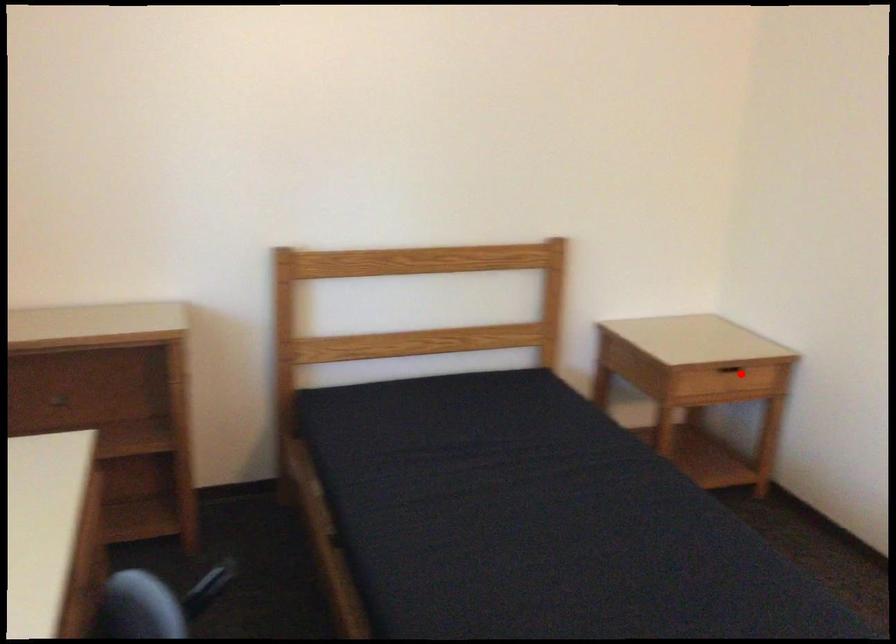
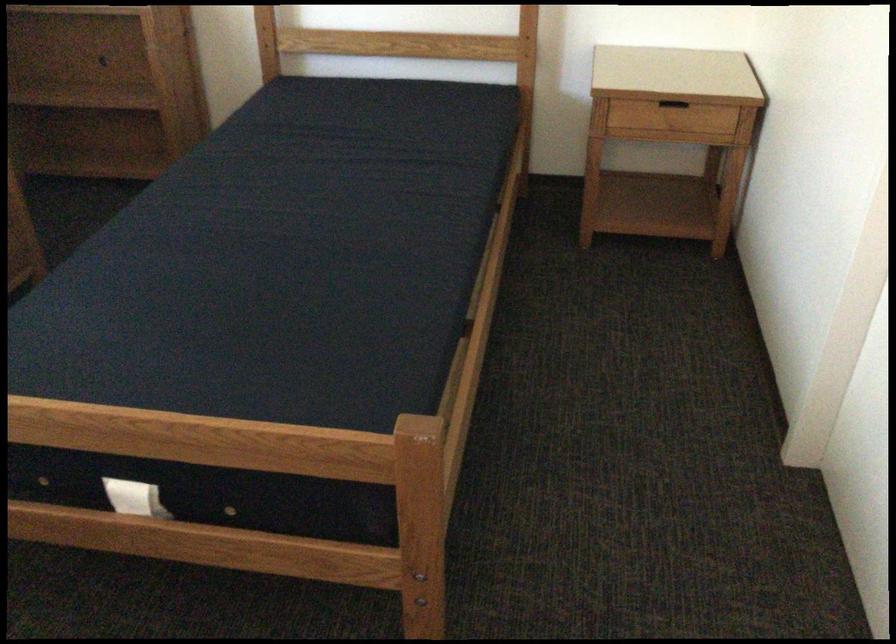
Find the pixel in the second image that matches the highlighted location in the first image.

(673, 109)